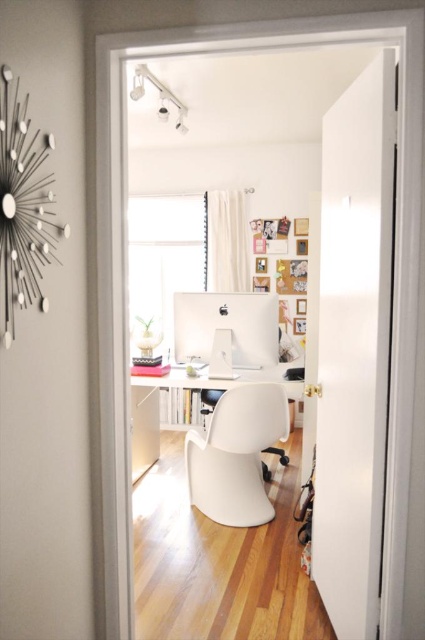
From the picture: You are standing in the doorway of the home office and see two points marked on the desk. Which point is closer to you, point (x=235, y=420) or point (x=175, y=323)?

Point (x=235, y=420) is closer to the viewer than point (x=175, y=323).

You are a delivery person carrying a box that is 20 inches wide. You need to place it between the white plastic swivel chair at center and the white glossy computer at center. Is there enough space for the box?

The distance between the white plastic swivel chair at center and the white glossy computer at center is 18.40 inches. Since the box is 20 inches wide, it is wider than the available space, so the box cannot fit between them.